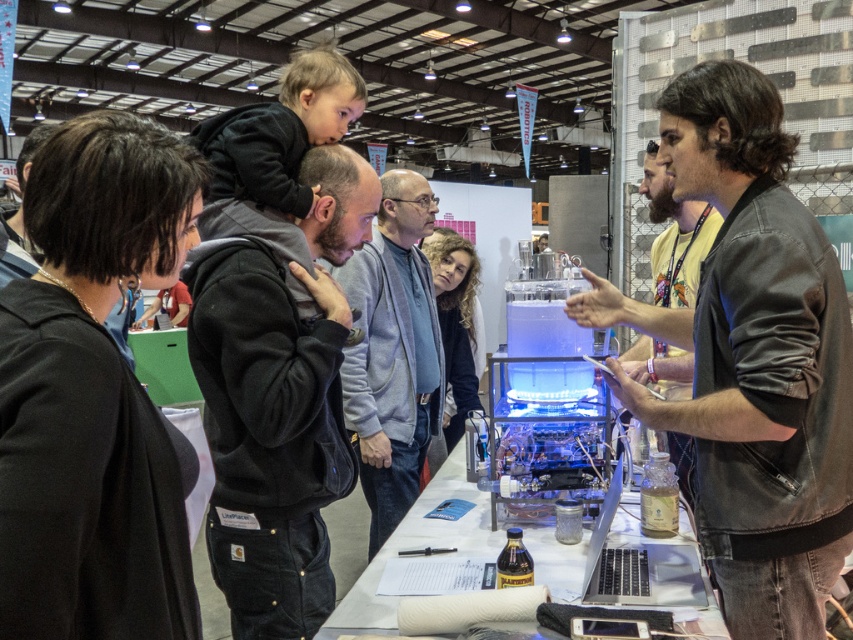
Question: From the image, what is the correct spatial relationship of gray fleece hoodie at center in relation to dark brown leather jacket at right?

Choices:
 (A) below
 (B) above

Answer: (A)

Question: Considering the relative positions of denim jacket at center and gray fleece hoodie at center in the image provided, where is denim jacket at center located with respect to gray fleece hoodie at center?

Choices:
 (A) above
 (B) below

Answer: (B)

Question: Considering the real-world distances, which object is farthest from the dark brown leather jacket at right?

Choices:
 (A) denim jacket at center
 (B) black fleece jacket at center
 (C) gray fleece hoodie at center

Answer: (C)

Question: Can you confirm if black fleece jacket at center is smaller than gray fleece hoodie at center?

Choices:
 (A) no
 (B) yes

Answer: (B)

Question: Estimate the real-world distances between objects in this image. Which object is closer to the gray fleece hoodie at center?

Choices:
 (A) black fleece jacket at center
 (B) dark brown leather jacket at right

Answer: (A)

Question: Based on their relative distances, which object is farther from the denim jacket at center?

Choices:
 (A) black fleece jacket at center
 (B) gray fleece hoodie at center

Answer: (B)